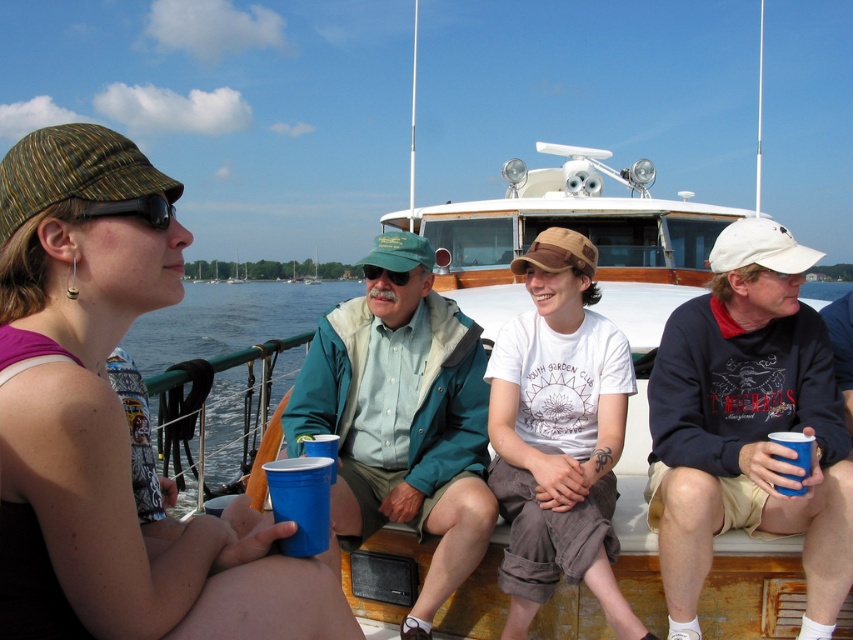
Between matte green cap at upper left and blue plastic cup at lower right, which one is positioned lower?

Positioned lower is blue plastic cup at lower right.

Does matte green cap at upper left appear on the right side of blue plastic cup at lower right?

In fact, matte green cap at upper left is to the left of blue plastic cup at lower right.

Is point (62, 474) in front of point (793, 433)?

Yes, point (62, 474) is closer to viewer.

The image size is (853, 640). What are the coordinates of `matte green cap at upper left` in the screenshot? It's located at 111,422.

Between black rubber goggles at upper left and blue plastic cup at lower right, which one appears on the right side from the viewer's perspective?

blue plastic cup at lower right is more to the right.

Which is behind, point (154, 212) or point (798, 458)?

The point (798, 458) is behind.

Which is in front, point (149, 195) or point (780, 435)?

Point (149, 195) is in front.

The width and height of the screenshot is (853, 640). I want to click on black rubber goggles at upper left, so click(132, 209).

Between point (283, 464) and point (782, 458), which one is positioned in front?

Point (283, 464)

In order to click on blue plastic cup at lower left in this screenshot , I will do `click(300, 500)`.

Which is in front, point (316, 472) or point (775, 435)?

Point (316, 472) is more forward.

You are a GUI agent. You are given a task and a screenshot of the screen. Output one action in this format:
    pyautogui.click(x=<x>, y=<y>)
    Task: Click on the blue plastic cup at lower left
    Image resolution: width=853 pixels, height=640 pixels.
    Given the screenshot: What is the action you would take?
    pyautogui.click(x=300, y=500)